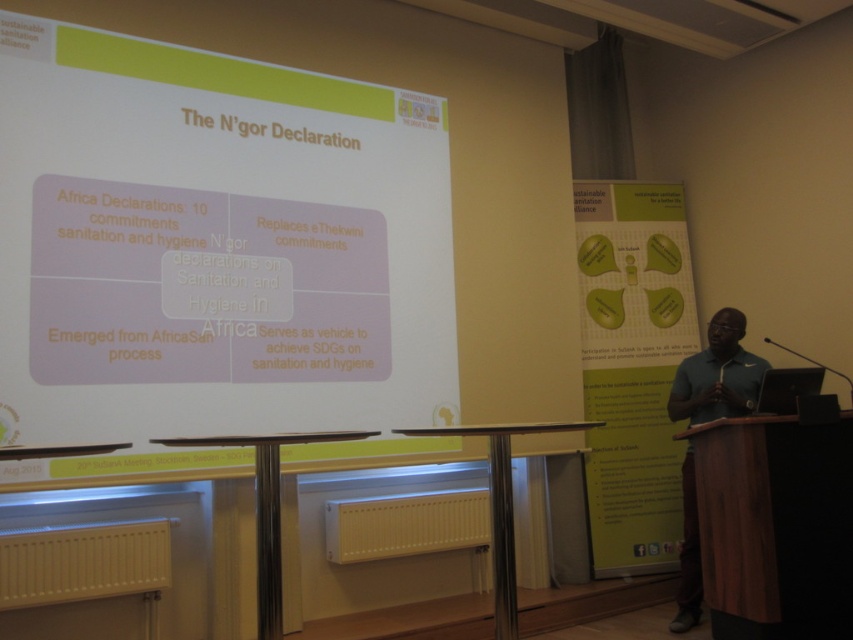
You are sitting in the conference room and want to determine which of the two points, point (157, 173) or point (729, 412), is closer to you. Based on the image, which point is nearer?

Point (157, 173) is closer to the viewer than point (729, 412).